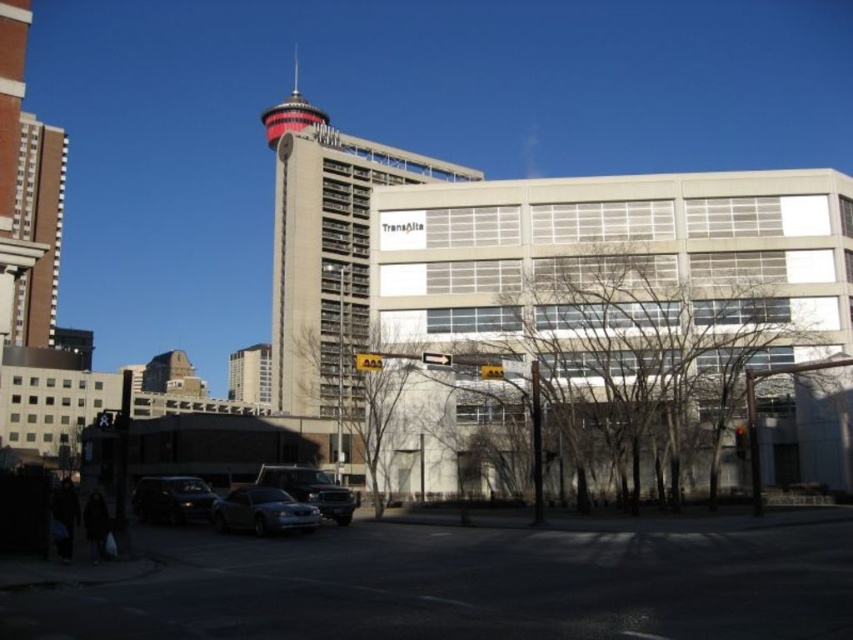
You are a city planner assessing the distance between two landmarks. You need to ensure that the brown concrete building at left and the red and white striped tower at upper center are at least 200 feet apart for safety regulations. Based on the image, are they compliant?

The brown concrete building at left is 206.04 feet from the red and white striped tower at upper center, which exceeds the required 200 feet distance. Therefore, they are compliant with safety regulations.

You are a delivery person who needs to park your vehicle near the shiny silver sedan at center without blocking the entrance of the brown concrete building at left. Based on the scene, can you safely park there?

The brown concrete building at left is closer to the viewer than the shiny silver sedan at center, so parking near the shiny silver sedan at center would not block the entrance of the brown concrete building at left.

You are a delivery driver who needs to park your truck, which is 3 meters wide, in this scene. You see the shiny silver sedan at center and the red and white striped tower at upper center. Can you park your truck between them without overlapping either?

The shiny silver sedan at center has a lesser width compared to the red and white striped tower at upper center. Since the truck is 3 meters wide, it depends on the available space between them. However, since the sedan is narrower than the tower, there might be sufficient space between them to park the truck without overlapping. However, without exact measurements, it is uncertain. Please check the actual distance on site.